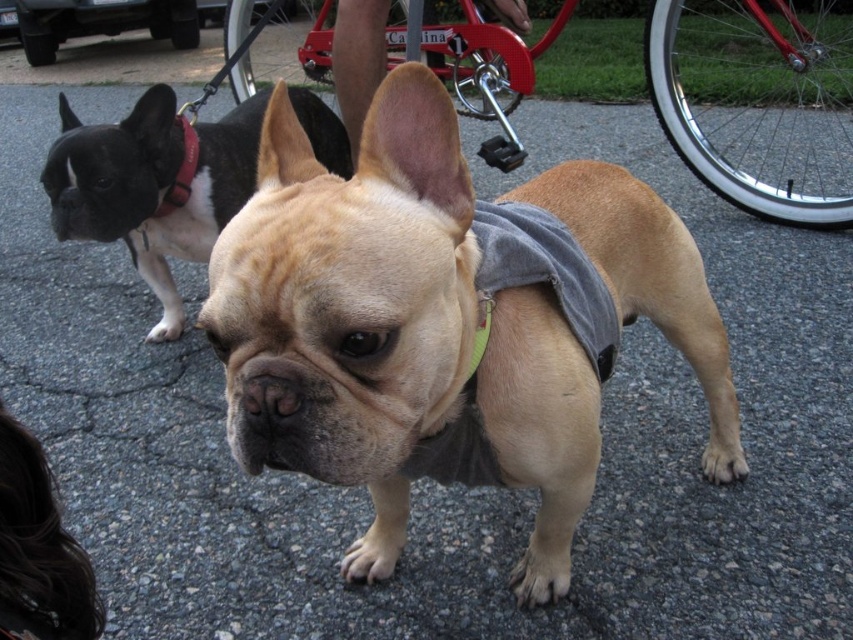
You are a photographer trying to capture both dogs in a single frame. Given that the matte tan french bulldog at center is blocking the view of the black fur dog at left, can you adjust your position to include both without moving the dogs?

The matte tan french bulldog at center is in front of the black fur dog at left, so moving your position slightly to the side or angle could allow you to capture both dogs in the frame without moving them.

You are standing in front of the two French Bulldogs in the image. You notice two points marked in the scene. Which point, point 1 at coordinates point (585, 428) or point 2 at coordinates point (186, 188), is nearer to you?

Point 1 at coordinates point (585, 428) is closer to the viewer than point 2 at coordinates point (186, 188).